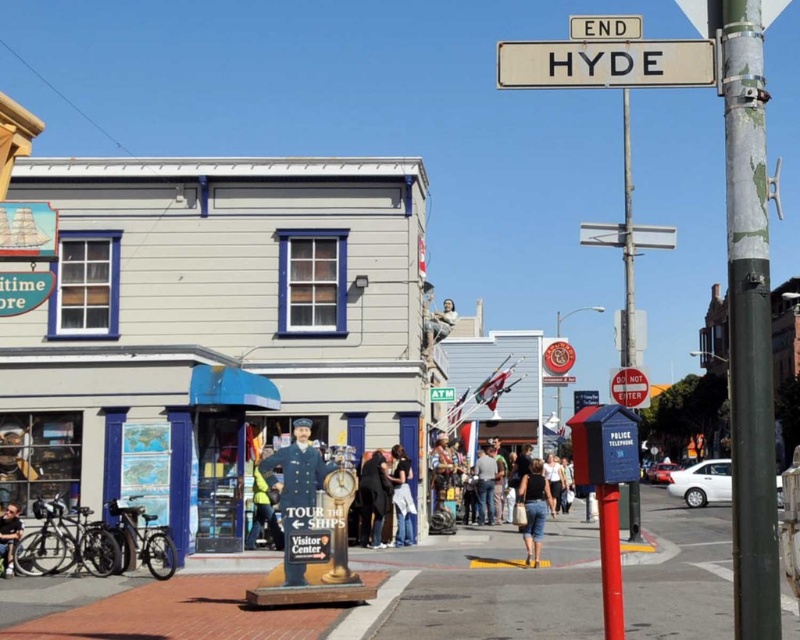
Question: Where is denim shorts at lower center located in relation to denim pants at center in the image?

Choices:
 (A) below
 (B) above

Answer: (B)

Question: In this image, where is uniformed statue at center located relative to yellow jacket at center?

Choices:
 (A) above
 (B) below

Answer: (A)

Question: Based on their relative distances, which object is farther from the white plastic street sign at upper center?

Choices:
 (A) denim shorts at lower center
 (B) dark blue uniform at lower left

Answer: (B)

Question: Is yellow jacket at center further to camera compared to white plastic atm sign at upper center?

Choices:
 (A) yes
 (B) no

Answer: (B)

Question: Based on their relative distances, which object is farther from the brick pavement at center?

Choices:
 (A) yellow jacket at center
 (B) dark blue jeans at center
 (C) dark blue uniform at center

Answer: (A)

Question: Among these objects, which one is nearest to the camera?

Choices:
 (A) dark blue uniform at lower left
 (B) brick pavement at center
 (C) yellow jacket at center
 (D) uniformed statue at center

Answer: (B)